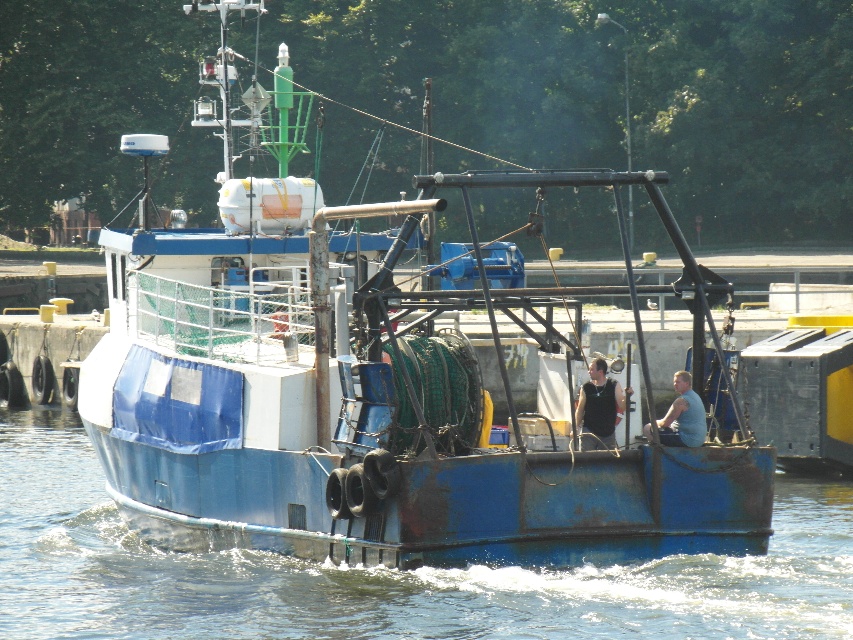
Question: In this image, where is black tank top at center located relative to blue fabric shirt at center?

Choices:
 (A) right
 (B) left

Answer: (B)

Question: Which point appears closest to the camera in this image?

Choices:
 (A) (44, 433)
 (B) (685, 378)

Answer: (B)

Question: Where is blue matte boat at center located in relation to blue fabric shirt at center in the image?

Choices:
 (A) above
 (B) below

Answer: (A)

Question: Which object is the farthest from the blue fabric shirt at center?

Choices:
 (A) blue metallic water at center
 (B) black tank top at center
 (C) blue matte boat at center

Answer: (A)

Question: Which object is farther from the camera taking this photo?

Choices:
 (A) blue metallic water at center
 (B) blue fabric shirt at center
 (C) black tank top at center
 (D) blue matte boat at center

Answer: (C)

Question: Is blue metallic water at center above blue fabric shirt at center?

Choices:
 (A) no
 (B) yes

Answer: (A)